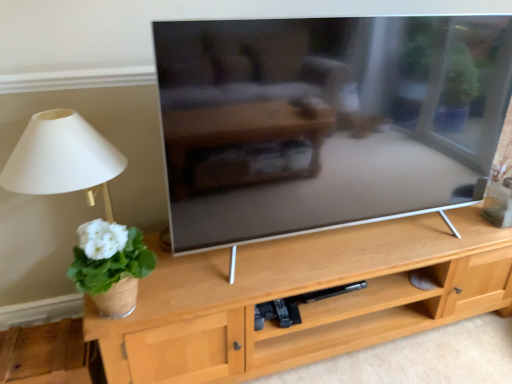
Question: Looking at their shapes, would you say white matte plant at left is wider or thinner than white fabric lampshade at left?

Choices:
 (A) thin
 (B) wide

Answer: (A)

Question: From the image's perspective, is white matte plant at left above or below white fabric lampshade at left?

Choices:
 (A) below
 (B) above

Answer: (A)

Question: Is white matte plant at left inside the boundaries of white fabric lampshade at left, or outside?

Choices:
 (A) outside
 (B) inside

Answer: (A)

Question: Is point (120, 307) closer or farther from the camera than point (102, 304)?

Choices:
 (A) farther
 (B) closer

Answer: (B)

Question: Considering the positions of white fabric lampshade at left and white matte plant at left in the image, is white fabric lampshade at left taller or shorter than white matte plant at left?

Choices:
 (A) tall
 (B) short

Answer: (A)

Question: In terms of size, does white fabric lampshade at left appear bigger or smaller than white matte plant at left?

Choices:
 (A) small
 (B) big

Answer: (B)

Question: Considering the relative positions of white fabric lampshade at left and white matte plant at left in the image provided, is white fabric lampshade at left to the left or to the right of white matte plant at left?

Choices:
 (A) right
 (B) left

Answer: (B)